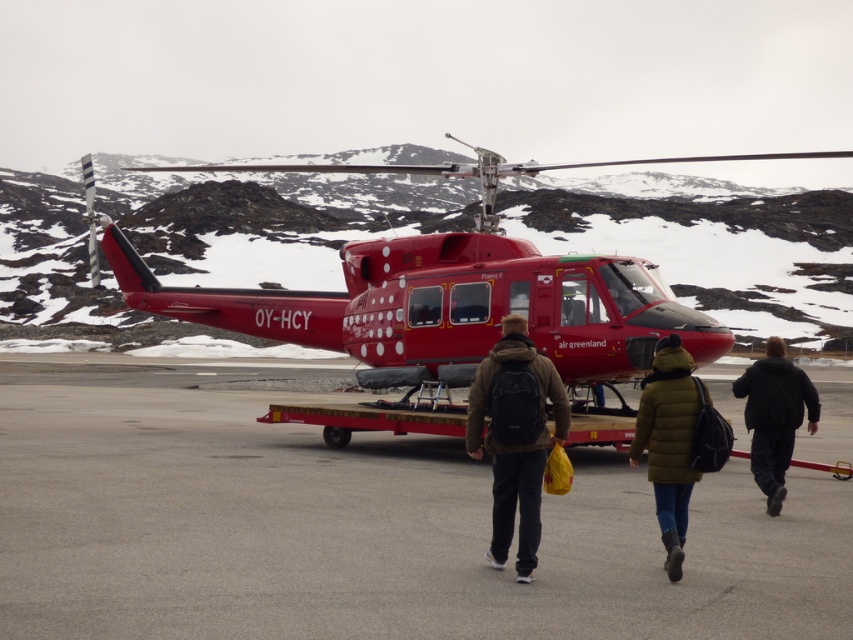
You are a photographer trying to capture a photo of the polished red helicopter at center and the black fuzzy jacket at lower right in the same frame. Based on their positions, which object is closer to the left edge of the photo?

The black fuzzy jacket at lower right is closer to the left edge of the photo because the polished red helicopter at center is positioned on the right side of it.